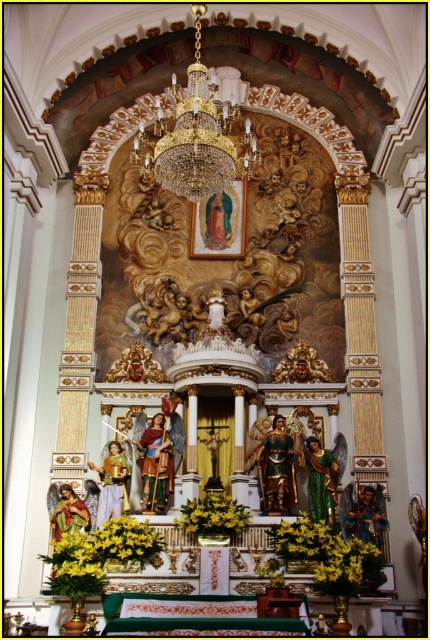
You are an altar decorator who needs to adjust the arrangement of the yellow matte flowers at center and the yellow fabric flower at center. Which one is currently placed above the other?

The yellow fabric flower at center is placed above the yellow matte flowers at center because the yellow matte flowers at center is positioned under it.

You are an altar decorator who needs to adjust the placement of the yellow fabric flowers at lower left and the yellow fabric flower at center. Which one is located below the other?

The yellow fabric flowers at lower left is positioned under the yellow fabric flower at center.

You are standing at the entrance of the church and looking towards the altar. There is a point marked at coordinates (107, 545) on the image. What object is located at this point?

The point marked at coordinates (107, 545) corresponds to the yellow fabric flowers at lower left.